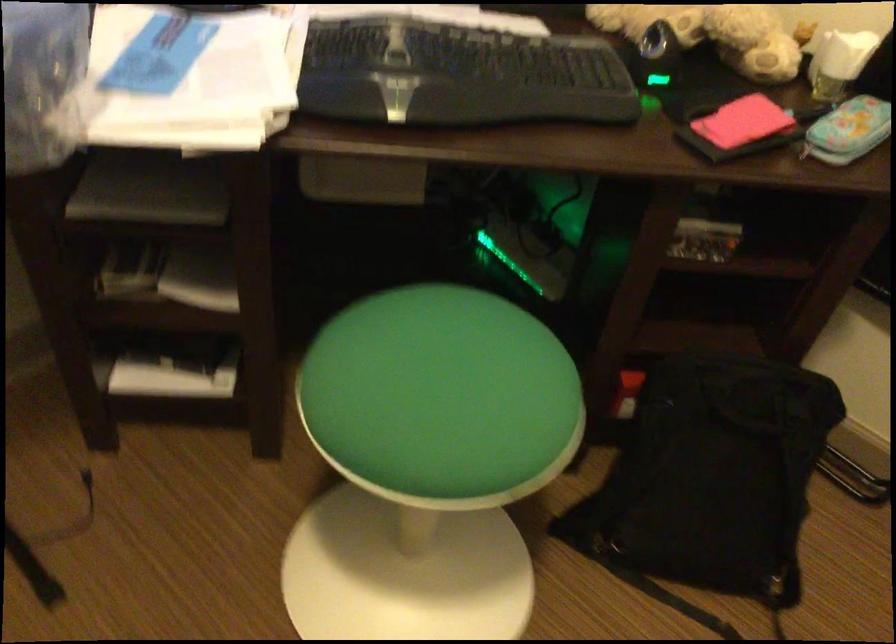
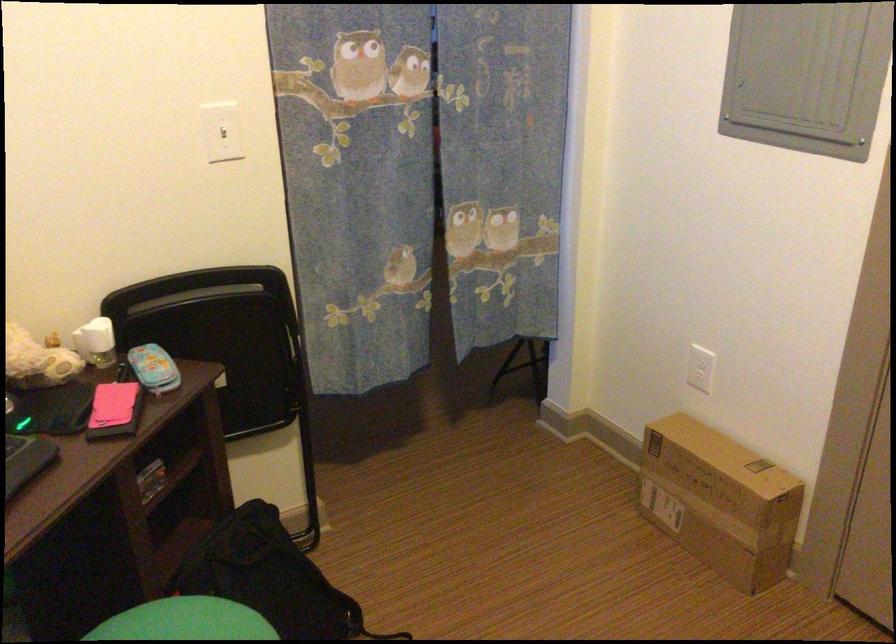
The point at (518, 362) is marked in the first image. Where is the corresponding point in the second image?

(185, 621)